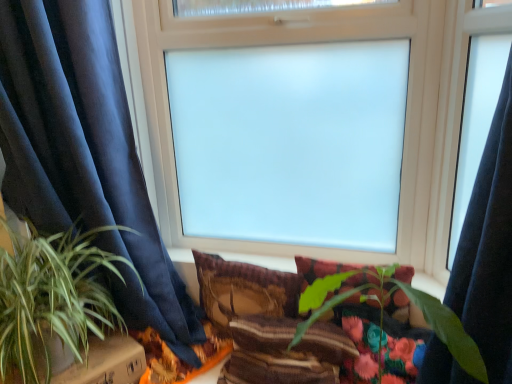
Question: From a real-world perspective, is plush fabric pillow at center, which is the third pillow from left to right, under frosted glass window at center?

Choices:
 (A) no
 (B) yes

Answer: (B)

Question: Is plush fabric pillow at center, which is counted as the first pillow, starting from the right, further to camera compared to frosted glass window at center?

Choices:
 (A) yes
 (B) no

Answer: (A)

Question: Considering the relative sizes of plush fabric pillow at center, which is the third pillow from left to right, and frosted glass window at center in the image provided, is plush fabric pillow at center, which is the third pillow from left to right, bigger than frosted glass window at center?

Choices:
 (A) yes
 (B) no

Answer: (B)

Question: Considering the relative sizes of plush fabric pillow at center, which is counted as the first pillow, starting from the right, and frosted glass window at center in the image provided, is plush fabric pillow at center, which is counted as the first pillow, starting from the right, taller than frosted glass window at center?

Choices:
 (A) yes
 (B) no

Answer: (B)

Question: Is the surface of plush fabric pillow at center, which is counted as the first pillow, starting from the right, in direct contact with frosted glass window at center?

Choices:
 (A) no
 (B) yes

Answer: (A)

Question: From a real-world perspective, is green leafy plant at center, placed as the 2th houseplant when sorted from left to right, above or below textured brown pillow at center, the first pillow from the left?

Choices:
 (A) below
 (B) above

Answer: (B)

Question: Is green leafy plant at center, arranged as the 1th houseplant when viewed from the right, wider or thinner than textured brown pillow at center, the 3th pillow viewed from the right?

Choices:
 (A) wide
 (B) thin

Answer: (A)

Question: Considering the relative positions of green leafy plant at center, arranged as the 1th houseplant when viewed from the right, and textured brown pillow at center, the 3th pillow viewed from the right, in the image provided, is green leafy plant at center, arranged as the 1th houseplant when viewed from the right, to the left or to the right of textured brown pillow at center, the 3th pillow viewed from the right,?

Choices:
 (A) right
 (B) left

Answer: (A)

Question: Relative to textured brown pillow at center, the 3th pillow viewed from the right, is green leafy plant at center, arranged as the 1th houseplant when viewed from the right, in front or behind?

Choices:
 (A) behind
 (B) front

Answer: (B)

Question: From a real-world perspective, is frosted glass window at center above or below plush fabric pillow at center, which is the third pillow from left to right?

Choices:
 (A) above
 (B) below

Answer: (A)

Question: Considering the positions of frosted glass window at center and plush fabric pillow at center, which is the third pillow from left to right, in the image, is frosted glass window at center wider or thinner than plush fabric pillow at center, which is the third pillow from left to right,?

Choices:
 (A) wide
 (B) thin

Answer: (A)

Question: Considering the positions of frosted glass window at center and plush fabric pillow at center, which is counted as the first pillow, starting from the right, in the image, is frosted glass window at center taller or shorter than plush fabric pillow at center, which is counted as the first pillow, starting from the right,?

Choices:
 (A) short
 (B) tall

Answer: (B)

Question: Would you say frosted glass window at center is to the left or to the right of plush fabric pillow at center, which is counted as the first pillow, starting from the right, in the picture?

Choices:
 (A) right
 (B) left

Answer: (B)

Question: Is green leafy plant at left, marked as the 2th houseplant in a right-to-left arrangement, to the left or to the right of plush fabric pillow at center, which is the third pillow from left to right, in the image?

Choices:
 (A) right
 (B) left

Answer: (B)

Question: From the image's perspective, is green leafy plant at left, marked as the 1th houseplant in a left-to-right arrangement, located above or below plush fabric pillow at center, which is counted as the first pillow, starting from the right?

Choices:
 (A) above
 (B) below

Answer: (A)